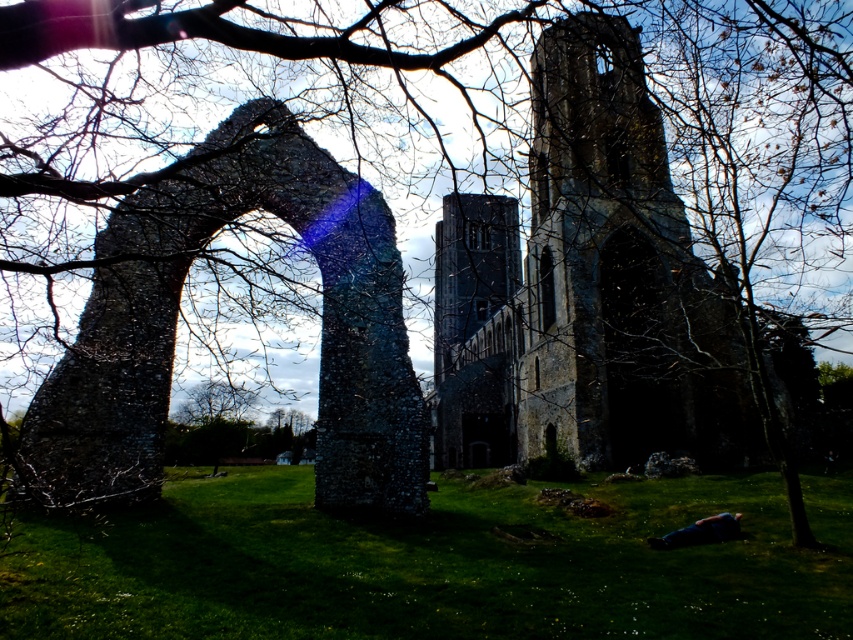
Who is lower down, rusty stone church at center or rustic stone arch at left?

rustic stone arch at left is lower down.

Which of these two, rusty stone church at center or rustic stone arch at left, stands shorter?

With less height is rustic stone arch at left.

Image resolution: width=853 pixels, height=640 pixels. I want to click on rusty stone church at center, so click(x=585, y=289).